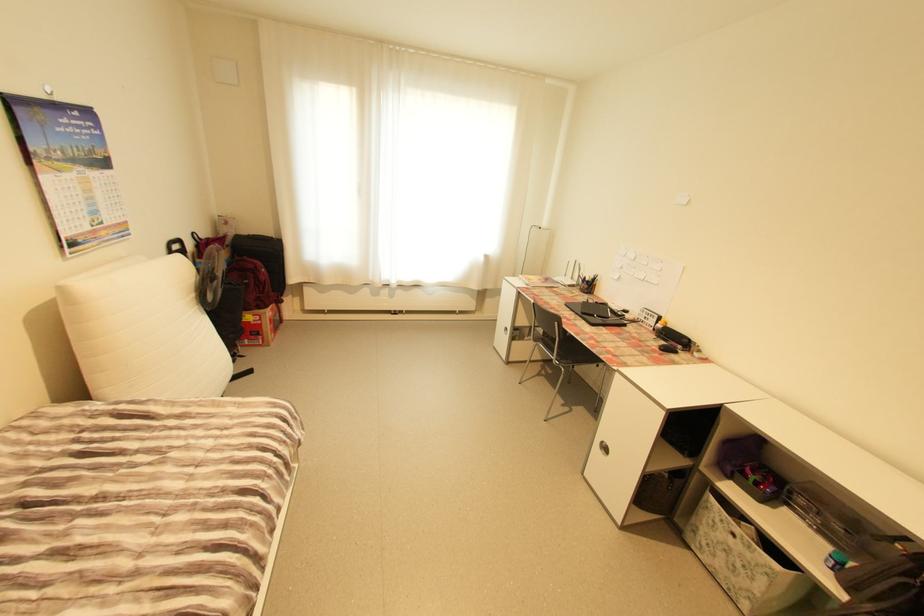
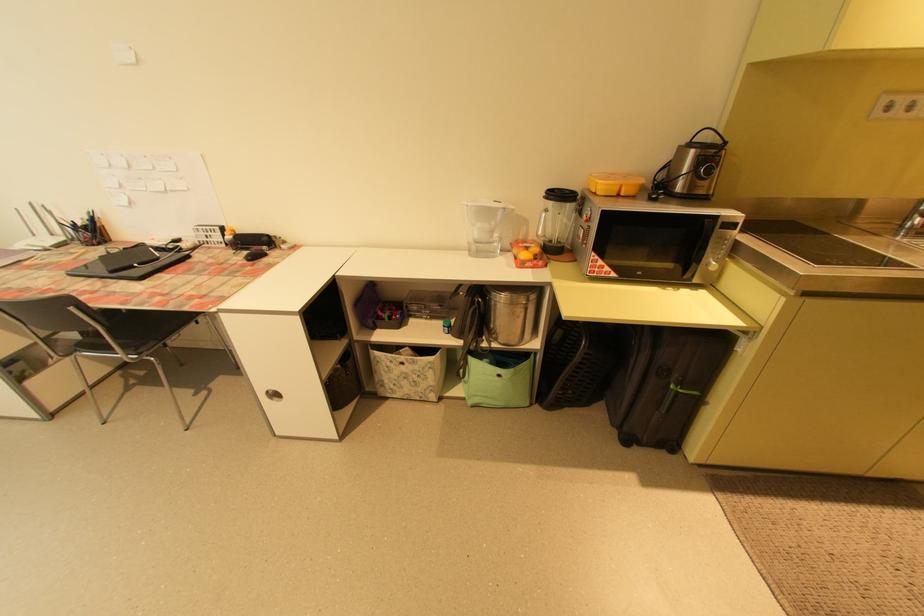
Find the pixel in the second image that matches point 770,581 in the first image.

(436, 374)